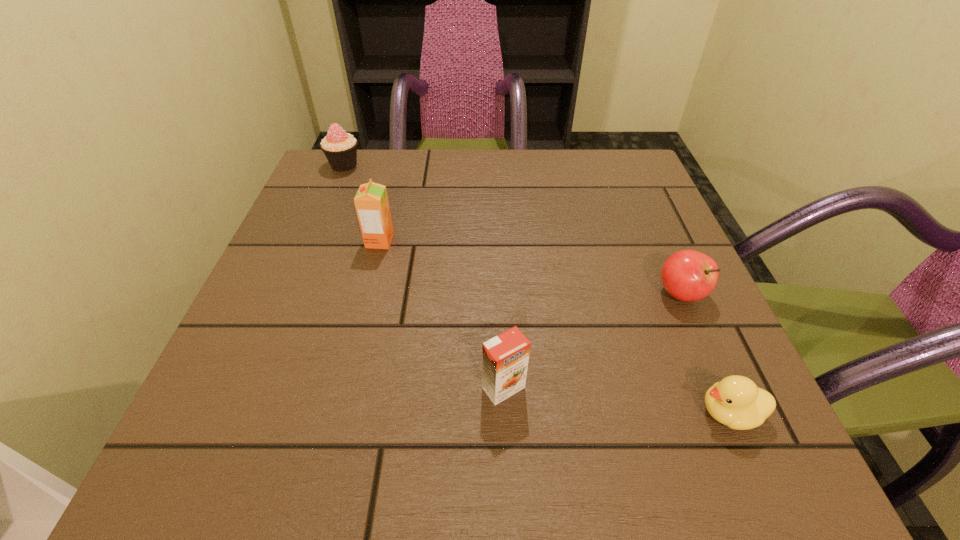
At what (x,y) coordinates should I click in order to perform the action: click on vacant region located 0.350m on the left of the nearer orange juice. Please return your answer as a coordinate pair (x, y). The width and height of the screenshot is (960, 540). Looking at the image, I should click on (246, 388).

Identify the location of vacant space located on the left of the third nearest object. (612, 293).

I want to click on vacant region located on the beak of the duckling, so click(x=655, y=413).

Image resolution: width=960 pixels, height=540 pixels. I want to click on vacant space situated 0.280m on the beak of the duckling, so click(x=499, y=413).

At what (x,y) coordinates should I click in order to perform the action: click on blank area located on the beak of the duckling. Please return your answer as a coordinate pair (x, y). The height and width of the screenshot is (540, 960). Looking at the image, I should click on (465, 413).

I want to click on object that is at the far edge, so click(x=340, y=148).

You are a GUI agent. You are given a task and a screenshot of the screen. Output one action in this format:
    pyautogui.click(x=<x>, y=<y>)
    Task: Click on the object located at the near edge
    This screenshot has height=540, width=960.
    Given the screenshot: What is the action you would take?
    pyautogui.click(x=735, y=401)

Identify the location of object present at the left edge. (340, 148).

The height and width of the screenshot is (540, 960). Identify the location of apple that is at the right edge. (688, 275).

This screenshot has width=960, height=540. I want to click on duckling that is at the right edge, so click(x=735, y=401).